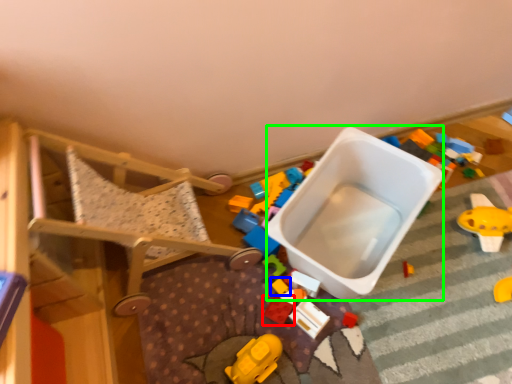
Question: Considering the real-world distances, which object is farthest from toy (highlighted by a red box)? toy (highlighted by a blue box) or storage box (highlighted by a green box)?

Choices:
 (A) toy
 (B) storage box

Answer: (B)